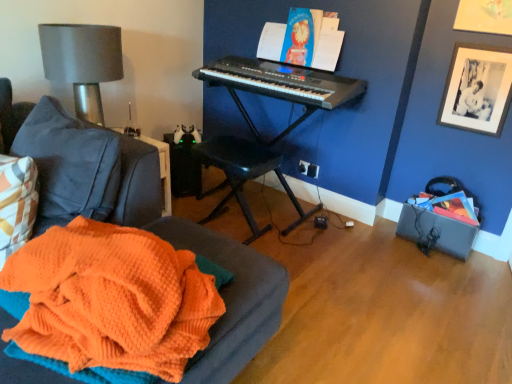
Question: Is orange knitted blanket at lower left wider or thinner than black plastic keyboard at center?

Choices:
 (A) thin
 (B) wide

Answer: (B)

Question: In terms of size, does orange knitted blanket at lower left appear bigger or smaller than black plastic keyboard at center?

Choices:
 (A) big
 (B) small

Answer: (B)

Question: Which object is positioned farthest from the black plastic keyboard at upper center?

Choices:
 (A) black plastic music stool at center
 (B) black plastic keyboard at center
 (C) matte gray lampshade at upper left
 (D) black matte picture frame at upper right
 (E) matte blue book at upper center

Answer: (C)

Question: Based on their relative distances, which object is farther from the orange knitted blanket at lower left?

Choices:
 (A) matte gray lampshade at upper left
 (B) matte blue book at upper center
 (C) black matte picture frame at upper right
 (D) black plastic keyboard at upper center
 (E) black plastic keyboard at center

Answer: (C)